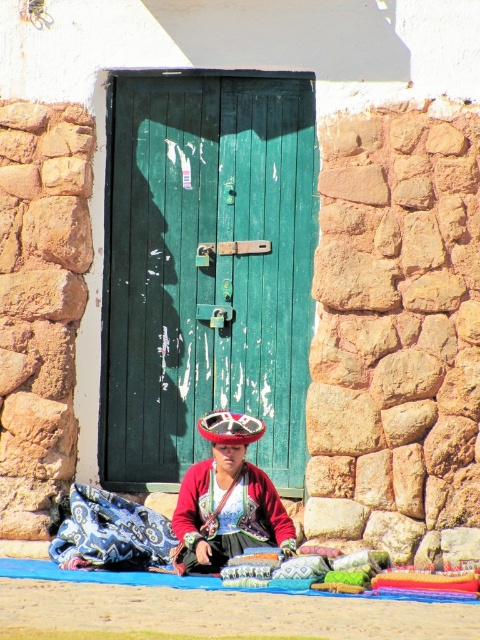
Identify the location of green wooden door at center. (205, 268).

Who is lower down, green wooden door at center or shiny metallic hat at center?

Positioned lower is shiny metallic hat at center.

Who is more forward, (140, 209) or (236, 435)?

Point (236, 435) is in front.

Find the location of `green wooden door at center`. green wooden door at center is located at coordinates (205, 268).

Between point (225, 499) and point (205, 419), which one is positioned behind?

Positioned behind is point (205, 419).

Does embroidered fabric dress at center have a greater width compared to shiny metallic hat at center?

Yes.

Is point (271, 481) behind point (257, 419)?

No, it is not.

This screenshot has height=640, width=480. I want to click on embroidered fabric dress at center, so click(x=227, y=499).

Does point (247, 96) lie in front of point (176, 516)?

No.

Who is lower down, green wooden door at center or embroidered fabric dress at center?

Positioned lower is embroidered fabric dress at center.

Does point (156, 314) lie behind point (287, 538)?

Yes.

Find the location of a particular element. green wooden door at center is located at coordinates (205, 268).